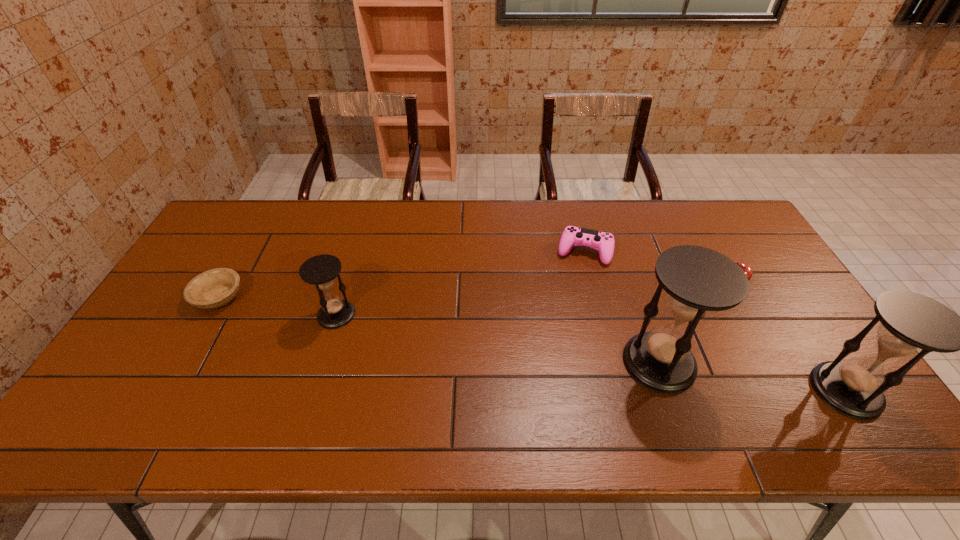
I want to click on the shortest hourglass, so click(321, 270).

At what (x,y) coordinates should I click in order to perform the action: click on the third tallest object. Please return your answer as a coordinate pair (x, y). The image size is (960, 540). Looking at the image, I should click on (321, 270).

Find the location of a particular element. This screenshot has width=960, height=540. the second hourglass from left to right is located at coordinates (697, 280).

The image size is (960, 540). In order to click on the second shortest hourglass in this screenshot , I will do `click(912, 324)`.

Locate an element on the screen. This screenshot has width=960, height=540. the rightmost object is located at coordinates (912, 324).

Image resolution: width=960 pixels, height=540 pixels. I want to click on the third shortest object, so click(x=746, y=268).

In order to click on apple in this screenshot , I will do `click(746, 268)`.

This screenshot has height=540, width=960. In order to click on the fifth tallest object in this screenshot , I will do `click(603, 242)`.

Identify the location of the farthest object. (603, 242).

You are a GUI agent. You are given a task and a screenshot of the screen. Output one action in this format:
    pyautogui.click(x=<x>, y=<y>)
    Task: Click on the leftmost object
    The height and width of the screenshot is (540, 960).
    Given the screenshot: What is the action you would take?
    pyautogui.click(x=214, y=288)